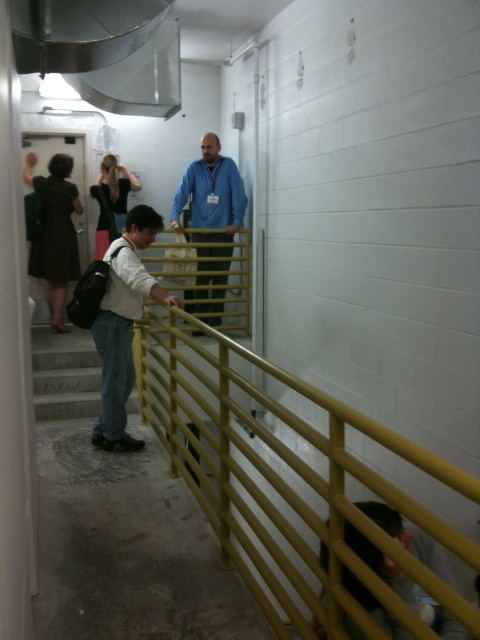
You are a maintenance worker needing to reach the yellow matte rail at center to perform a safety inspection. Your tool belt is attached to your denim jeans at center. Can you safely reach the rail without moving your position?

The distance between the yellow matte rail at center and the denim jeans at center is 27.49 inches. Since the tool belt is attached to the denim jeans, you can safely reach the rail as 27.49 inches is within a comfortable reach for most adults.

You are observing two people in the scene. Which clothing item is shorter between the denim jeans at center and the blue fabric shirt at center?

The denim jeans at center is shorter than the blue fabric shirt at center.

Based on the photo, based on the scene description, where is the denim jeans at center located in terms of its 2D coordinates?

The denim jeans at center is located at the 2D coordinates point (123, 324).